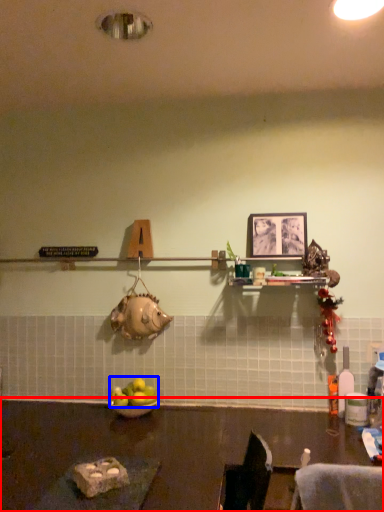
Question: Among these objects, which one is nearest to the camera, table (highlighted by a red box) or apple (highlighted by a blue box)?

Choices:
 (A) table
 (B) apple

Answer: (A)